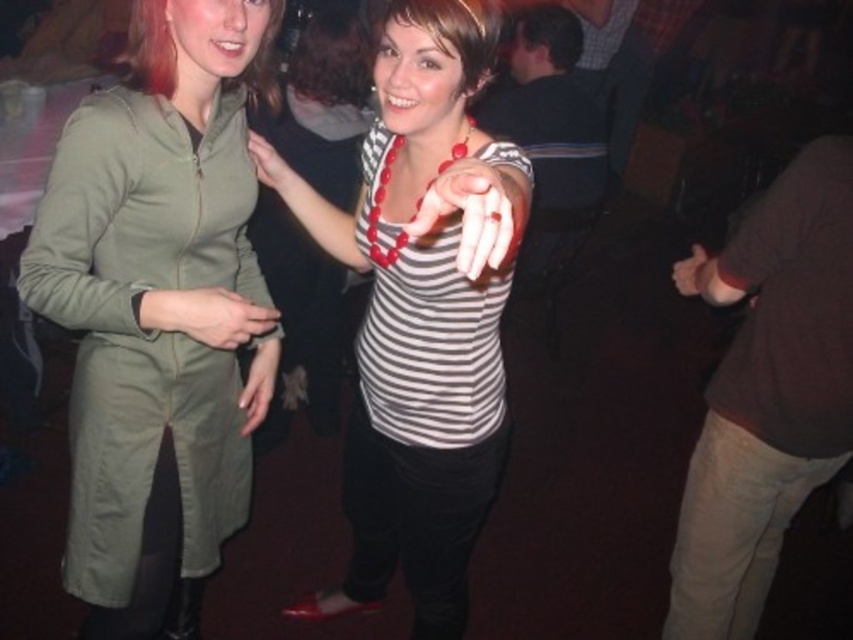
You are a photographer at the party and want to take a closeup photo of the matte red beaded necklace at center. The camera you have can focus on objects within 24 inches. Can you capture a clear closeup without moving the necklace?

The matte red beaded necklace at center is 28.78 inches away from the viewer. Since the camera requires objects to be within 24 inches for clear focus, the necklace is too far away to capture a clear closeup without moving it closer.

You are a photographer at the party and want to take a closeup of the matte red beaded necklace at center and the matte green jacket at center. Since the camera can only focus on one subject at a time, which object should you choose to focus on to ensure it appears sharp in the photo?

The matte red beaded necklace at center is in front of the matte green jacket at center. To ensure sharpness, focus on the matte red beaded necklace at center since it is closer to the camera.